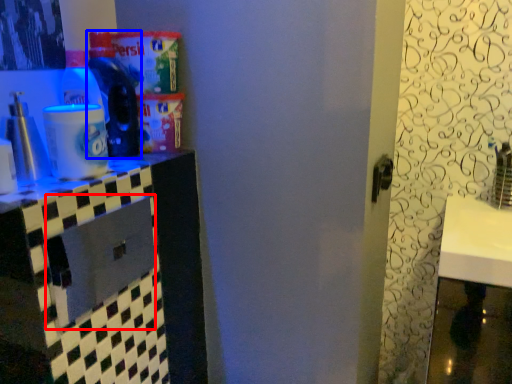
Question: Which of the following is the farthest to the observer, drawer (highlighted by a red box) or bottle (highlighted by a blue box)?

Choices:
 (A) drawer
 (B) bottle

Answer: (B)